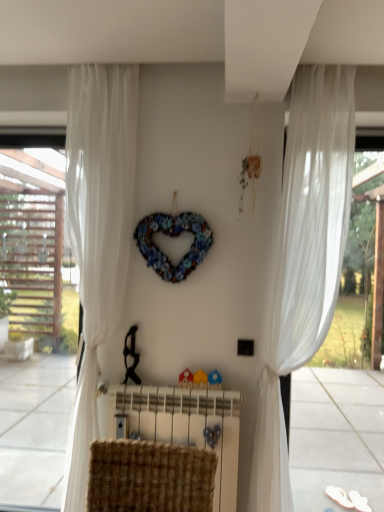
This screenshot has height=512, width=384. Describe the element at coordinates (97, 233) in the screenshot. I see `white sheer curtain at left, positioned as the second curtain in right-to-left order` at that location.

What do you see at coordinates (183, 426) in the screenshot?
I see `woven fabric radiator at center` at bounding box center [183, 426].

The width and height of the screenshot is (384, 512). Find the location of `woven fabric radiator at center`. woven fabric radiator at center is located at coordinates (183, 426).

Describe the element at coordinates (304, 258) in the screenshot. I see `white sheer curtain at right, the first curtain when ordered from right to left` at that location.

Consider the image. What is the approximate width of multicolored fabric heart at center?

It is 3.64 inches.

Describe the element at coordinates (355, 288) in the screenshot. This screenshot has width=384, height=512. I see `white sheer curtain at right` at that location.

I want to click on white sheer curtain at left, which is the 1th curtain in left-to-right order, so click(97, 233).

Identify the location of wreath located above the white sheer curtain at right, the first curtain when ordered from right to left (from a real-world perspective). (173, 236).

Considering the positions of objects white sheer curtain at right, the first curtain when ordered from right to left, and multicolored fabric heart at center in the image provided, who is more to the left, white sheer curtain at right, the first curtain when ordered from right to left, or multicolored fabric heart at center?

multicolored fabric heart at center.

Is white sheer curtain at right, which is the 2th curtain in left-to-right order, far from multicolored fabric heart at center?

No.

In the scene shown: Considering the relative positions of multicolored fabric heart at center and white sheer curtain at right, the first curtain when ordered from right to left, in the image provided, is multicolored fabric heart at center to the left of white sheer curtain at right, the first curtain when ordered from right to left, from the viewer's perspective?

Indeed, multicolored fabric heart at center is positioned on the left side of white sheer curtain at right, the first curtain when ordered from right to left.

From the image's perspective, is multicolored fabric heart at center located beneath white sheer curtain at right, the first curtain when ordered from right to left?

Actually, multicolored fabric heart at center appears above white sheer curtain at right, the first curtain when ordered from right to left, in the image.

Is multicolored fabric heart at center in front of or behind white sheer curtain at right, which is the 2th curtain in left-to-right order, in the image?

Clearly, multicolored fabric heart at center is behind white sheer curtain at right, which is the 2th curtain in left-to-right order.

Based on their sizes in the image, would you say multicolored fabric heart at center is bigger or smaller than white sheer curtain at right, the first curtain when ordered from right to left?

Clearly, multicolored fabric heart at center is smaller in size than white sheer curtain at right, the first curtain when ordered from right to left.

Consider the image. Can you confirm if woven fabric radiator at center is wider than white sheer curtain at left, which is the 1th curtain in left-to-right order?

No.

Considering the sizes of objects woven fabric radiator at center and white sheer curtain at left, which is the 1th curtain in left-to-right order, in the image provided, who is taller, woven fabric radiator at center or white sheer curtain at left, which is the 1th curtain in left-to-right order,?

white sheer curtain at left, which is the 1th curtain in left-to-right order, is taller.

Would you say white sheer curtain at left, positioned as the second curtain in right-to-left order, is part of woven fabric radiator at center's contents?

No, white sheer curtain at left, positioned as the second curtain in right-to-left order, is located outside of woven fabric radiator at center.

Is woven fabric radiator at center not within white sheer curtain at right, which is the 2th curtain in left-to-right order?

Yes, woven fabric radiator at center is located beyond the bounds of white sheer curtain at right, which is the 2th curtain in left-to-right order.

Is woven fabric radiator at center touching white sheer curtain at right, which is the 2th curtain in left-to-right order?

No, woven fabric radiator at center is not making contact with white sheer curtain at right, which is the 2th curtain in left-to-right order.

Is woven fabric radiator at center looking in the opposite direction of white sheer curtain at right, which is the 2th curtain in left-to-right order?

No, woven fabric radiator at center's orientation is not away from white sheer curtain at right, which is the 2th curtain in left-to-right order.

Which of these two, white sheer curtain at right or woven fabric radiator at center, is thinner?

white sheer curtain at right.

Which object is positioned more to the right, white sheer curtain at right or woven fabric radiator at center?

white sheer curtain at right.

From their relative heights in the image, would you say white sheer curtain at right is taller or shorter than woven fabric radiator at center?

In the image, white sheer curtain at right appears to be taller than woven fabric radiator at center.

Choose the correct answer: Is white sheer curtain at right inside woven fabric radiator at center or outside it?

white sheer curtain at right is not enclosed by woven fabric radiator at center.

From a real-world perspective, who is located higher, white sheer curtain at left, which is the 1th curtain in left-to-right order, or white sheer curtain at right?

white sheer curtain at left, which is the 1th curtain in left-to-right order.

Is white sheer curtain at left, which is the 1th curtain in left-to-right order, looking in the opposite direction of white sheer curtain at right?

white sheer curtain at left, which is the 1th curtain in left-to-right order, is not turned away from white sheer curtain at right.

From the image's perspective, who appears lower, white sheer curtain at left, which is the 1th curtain in left-to-right order, or white sheer curtain at right?

From the image's view, white sheer curtain at right is below.

From the image's perspective, is white sheer curtain at right over multicolored fabric heart at center?

No, from the image's perspective, white sheer curtain at right is not above multicolored fabric heart at center.

How many degrees apart are the facing directions of white sheer curtain at right and multicolored fabric heart at center?

They differ by 0.171 degrees in their facing directions.

From a real-world perspective, which is physically below, white sheer curtain at right or multicolored fabric heart at center?

From a 3D spatial view, white sheer curtain at right is below.

Is white sheer curtain at right at the right side of multicolored fabric heart at center?

Indeed, white sheer curtain at right is positioned on the right side of multicolored fabric heart at center.

This screenshot has width=384, height=512. In the image, there is a white sheer curtain at right, which is the 2th curtain in left-to-right order. Find the location of `wreath above it (from the image's perspective)`. wreath above it (from the image's perspective) is located at coordinates (173, 236).

I want to click on wreath behind the white sheer curtain at right, which is the 2th curtain in left-to-right order, so click(x=173, y=236).

Estimate the real-world distances between objects in this image. Which object is closer to white sheer curtain at right, which is the 2th curtain in left-to-right order, multicolored fabric heart at center or woven fabric radiator at center?

woven fabric radiator at center lies closer to white sheer curtain at right, which is the 2th curtain in left-to-right order, than the other object.

Which object lies further to the anchor point multicolored fabric heart at center, white sheer curtain at right, the first curtain when ordered from right to left, or white sheer curtain at left, positioned as the second curtain in right-to-left order?

Result: white sheer curtain at right, the first curtain when ordered from right to left.

From the image, which object appears to be farther from white sheer curtain at right, which is the 2th curtain in left-to-right order, multicolored fabric heart at center or white sheer curtain at left, which is the 1th curtain in left-to-right order?

white sheer curtain at left, which is the 1th curtain in left-to-right order, is positioned further to the anchor white sheer curtain at right, which is the 2th curtain in left-to-right order.

Considering their positions, is white sheer curtain at left, positioned as the second curtain in right-to-left order, positioned closer to white sheer curtain at right, which is the 2th curtain in left-to-right order, than white sheer curtain at right?

white sheer curtain at right is closer to white sheer curtain at right, which is the 2th curtain in left-to-right order.

Which object lies further to the anchor point multicolored fabric heart at center, white sheer curtain at left, positioned as the second curtain in right-to-left order, or white sheer curtain at right?

The object further to multicolored fabric heart at center is white sheer curtain at right.

From the picture: From the image, which object appears to be nearer to multicolored fabric heart at center, white sheer curtain at right or white sheer curtain at right, the first curtain when ordered from right to left?

Among the two, white sheer curtain at right, the first curtain when ordered from right to left, is located nearer to multicolored fabric heart at center.

Estimate the real-world distances between objects in this image. Which object is closer to white sheer curtain at left, positioned as the second curtain in right-to-left order, white sheer curtain at right or multicolored fabric heart at center?

multicolored fabric heart at center lies closer to white sheer curtain at left, positioned as the second curtain in right-to-left order, than the other object.

Estimate the real-world distances between objects in this image. Which object is closer to white sheer curtain at left, positioned as the second curtain in right-to-left order, white sheer curtain at right or woven fabric radiator at center?

woven fabric radiator at center.

The width and height of the screenshot is (384, 512). Identify the location of wreath between white sheer curtain at left, which is the 1th curtain in left-to-right order, and white sheer curtain at right, the first curtain when ordered from right to left. (173, 236).

Image resolution: width=384 pixels, height=512 pixels. I want to click on window screen between multicolored fabric heart at center and woven fabric radiator at center in the up-down direction, so click(355, 288).

Where is `curtain between woven fabric radiator at center and white sheer curtain at right`? curtain between woven fabric radiator at center and white sheer curtain at right is located at coordinates (304, 258).

Identify the location of curtain situated between multicolored fabric heart at center and white sheer curtain at right from left to right. The width and height of the screenshot is (384, 512). (304, 258).